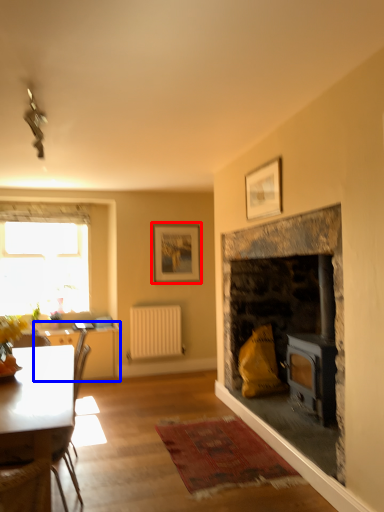
Question: Which of the following is the farthest to the observer, picture frame (highlighted by a red box) or table (highlighted by a blue box)?

Choices:
 (A) picture frame
 (B) table

Answer: (A)